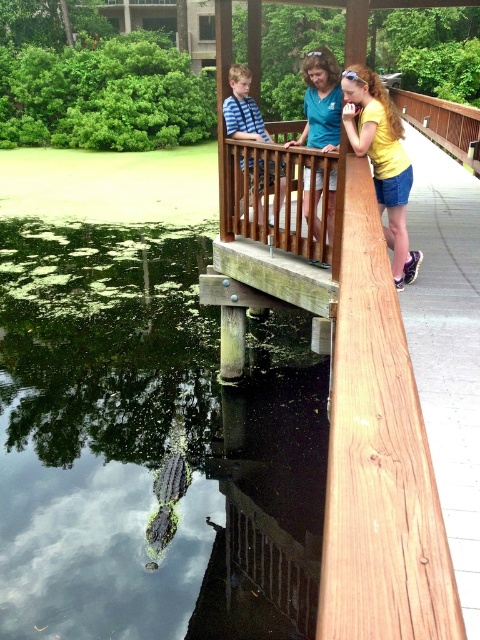
Does yellow matte shirt at upper right appear on the left side of matte blue shirt at upper center?

Incorrect, yellow matte shirt at upper right is not on the left side of matte blue shirt at upper center.

Which is below, yellow matte shirt at upper right or matte blue shirt at upper center?

yellow matte shirt at upper right is below.

Which is behind, point (405, 173) or point (320, 224)?

Positioned behind is point (320, 224).

I want to click on yellow matte shirt at upper right, so click(382, 160).

Can you confirm if matte blue shirt at upper center is bigger than striped cotton shirt at upper center?

Yes.

Can you confirm if matte blue shirt at upper center is positioned above striped cotton shirt at upper center?

Indeed, matte blue shirt at upper center is positioned over striped cotton shirt at upper center.

Between point (304, 81) and point (269, 224), which one is positioned in front?

Point (269, 224)

Identify the location of matte blue shirt at upper center. Image resolution: width=480 pixels, height=640 pixels. (321, 100).

Based on the photo, which is more to the right, wooden railing at upper center or striped cotton shirt at upper center?

wooden railing at upper center is more to the right.

Find the location of `wooden railing at upper center`. wooden railing at upper center is located at coordinates (277, 195).